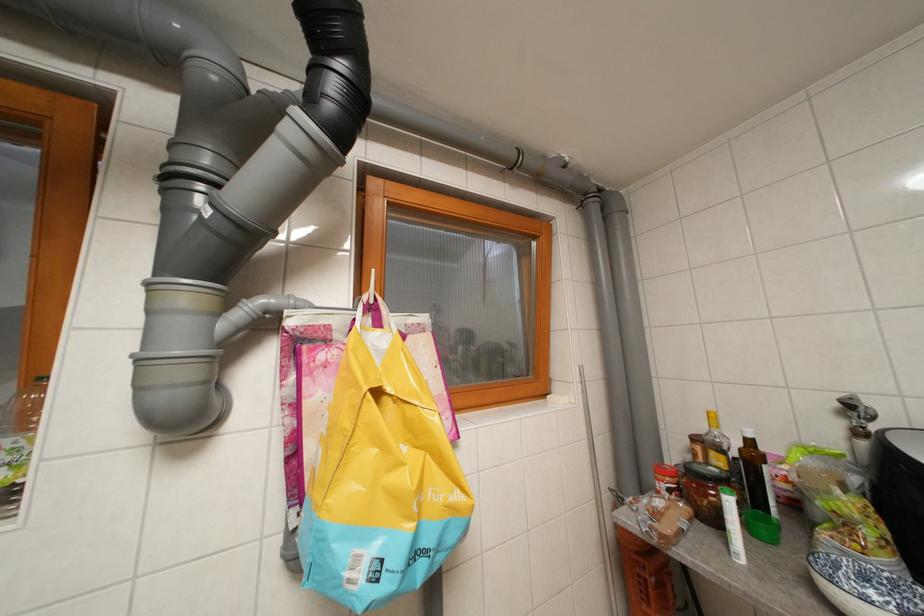
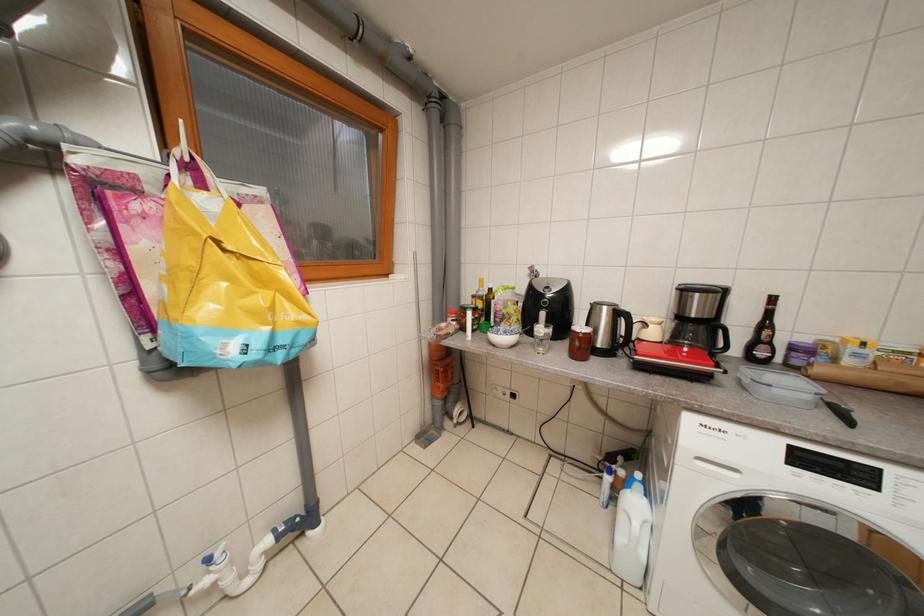
Based on the continuous images, in which direction is the camera rotating?

The camera's rotation is toward right-down.